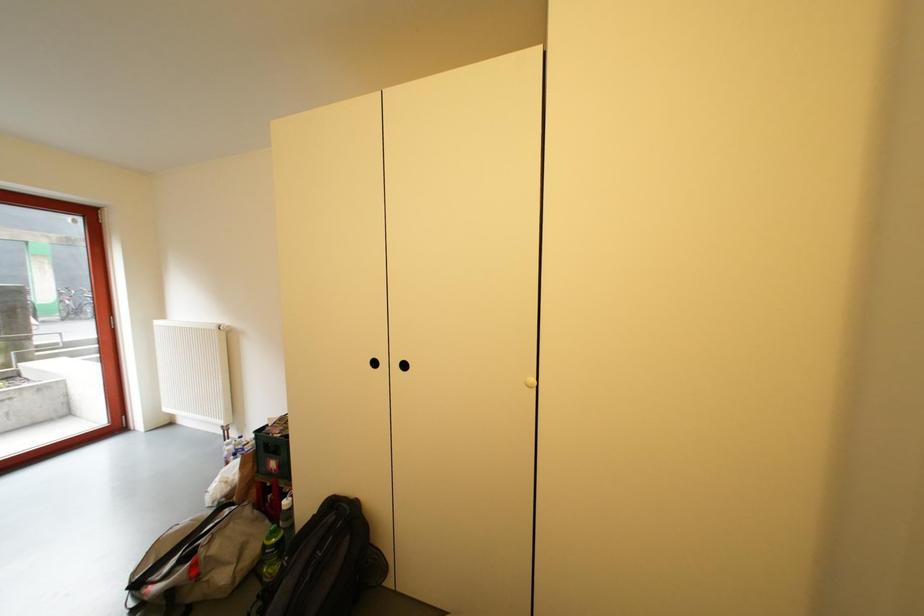
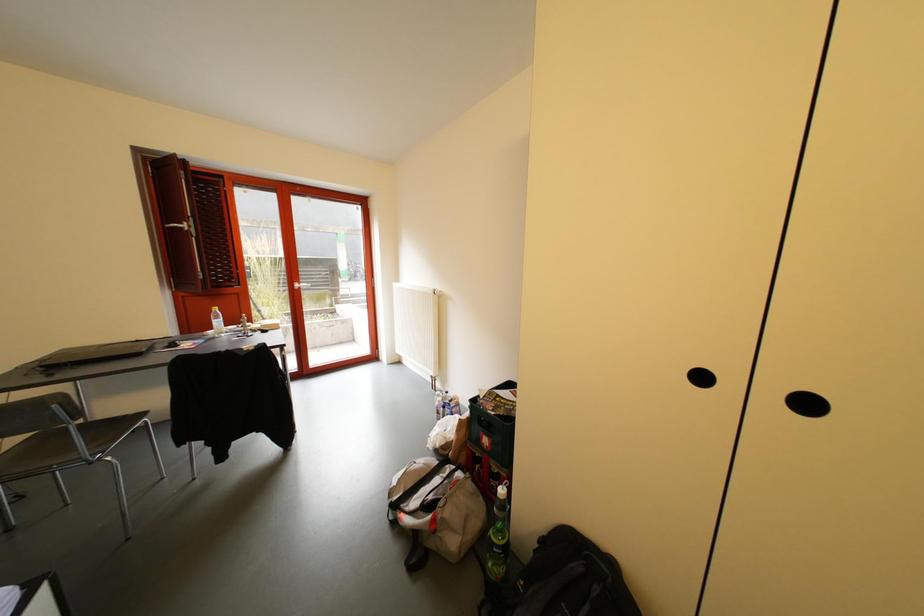
Question: The camera is either moving clockwise (left) or counter-clockwise (right) around the object. The first image is from the beginning of the video and the second image is from the end. Is the camera moving left or right when shooting the video?

Choices:
 (A) Left
 (B) Right

Answer: (B)